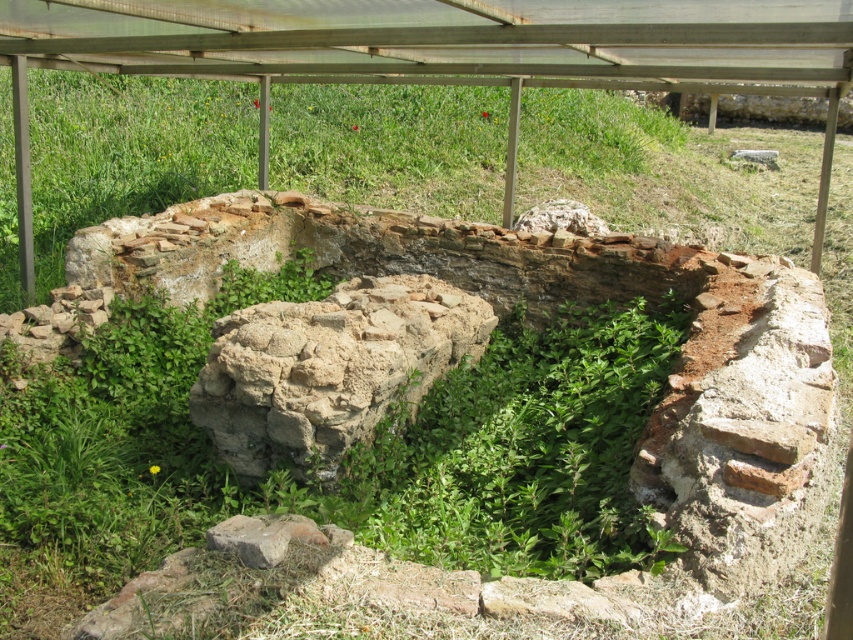
Question: Which object is the farthest from the brown rough stone at center?

Choices:
 (A) rusty brick stone at lower left
 (B) green leafy weed at center

Answer: (A)

Question: Does green leafy weed at center have a larger size compared to brown rough stone at center?

Choices:
 (A) yes
 (B) no

Answer: (A)

Question: Does green leafy weed at center have a smaller size compared to rusty brick stone at lower left?

Choices:
 (A) no
 (B) yes

Answer: (A)

Question: Which point appears closest to the camera in this image?

Choices:
 (A) (323, 442)
 (B) (299, 536)

Answer: (B)

Question: Is green leafy weed at center bigger than rusty brick stone at lower left?

Choices:
 (A) no
 (B) yes

Answer: (B)

Question: Which point is farther to the camera?

Choices:
 (A) (345, 413)
 (B) (264, 545)
 (C) (467, 509)

Answer: (A)